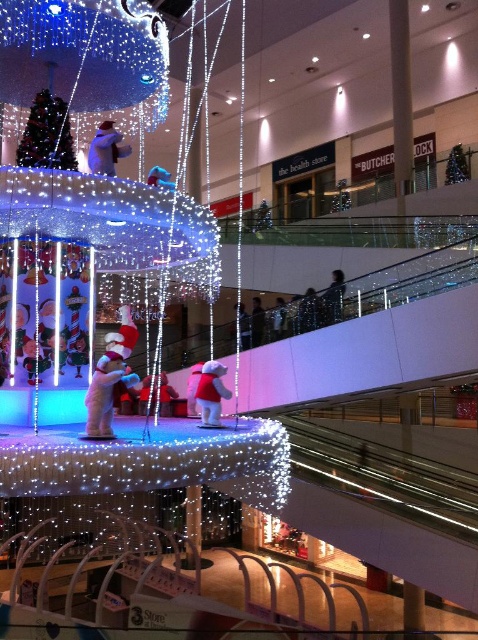
Please provide the exact coordinates of the white plush bear at center in the image.

The white plush bear at center is located at coordinates point (106,148).

You are a holiday shopper passing by the festive display. You notice the matte red plush bear at center and the white plush bear at center. Which bear has a smaller width?

The matte red plush bear at center is thinner than the white plush bear at center, so the matte red plush bear at center has a smaller width.

You are a visitor at the mall and want to take a photo of both the matte red plush bear at center and the white plush bear at center. Which bear should you focus on first to ensure both are in clear focus?

The matte red plush bear at center is closer to the viewer than the white plush bear at center, so focus on the matte red plush bear at center first to ensure both are in clear focus.